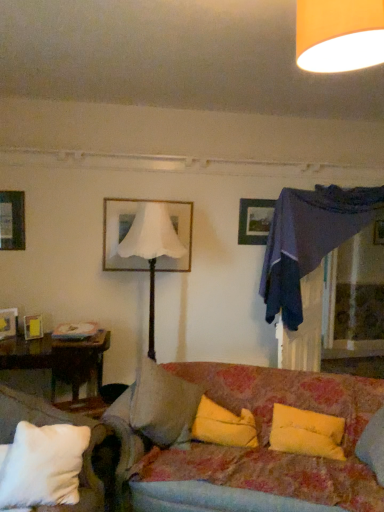
Question: Can you confirm if orange fabric lampshade at upper center, which appears as the 2th lamp when ordered from the bottom, is smaller than floral fabric couch at center?

Choices:
 (A) no
 (B) yes

Answer: (B)

Question: Is orange fabric lampshade at upper center, positioned as the 2th lamp in back-to-front order, shorter than floral fabric couch at center?

Choices:
 (A) no
 (B) yes

Answer: (B)

Question: From the image's perspective, is orange fabric lampshade at upper center, which is the 2th lamp from left to right, above floral fabric couch at center?

Choices:
 (A) yes
 (B) no

Answer: (A)

Question: Can you confirm if orange fabric lampshade at upper center, positioned as the 2th lamp in back-to-front order, is bigger than floral fabric couch at center?

Choices:
 (A) no
 (B) yes

Answer: (A)

Question: Is orange fabric lampshade at upper center, which ranks as the first lamp in front-to-back order, not close to floral fabric couch at center?

Choices:
 (A) no
 (B) yes

Answer: (B)

Question: From the image's perspective, is dark blue fabric canopy bed at upper right located above or below floral fabric couch at center?

Choices:
 (A) below
 (B) above

Answer: (B)

Question: In terms of width, does dark blue fabric canopy bed at upper right look wider or thinner when compared to floral fabric couch at center?

Choices:
 (A) thin
 (B) wide

Answer: (A)

Question: Considering the positions of point (344, 228) and point (279, 373), is point (344, 228) closer or farther from the camera than point (279, 373)?

Choices:
 (A) closer
 (B) farther

Answer: (B)

Question: Based on their positions, is dark blue fabric canopy bed at upper right located to the left or right of floral fabric couch at center?

Choices:
 (A) left
 (B) right

Answer: (B)

Question: Considering the positions of white matte picture frame at upper center, the fourth picture frame in the left-to-right sequence, and brown wooden table at lower left in the image, is white matte picture frame at upper center, the fourth picture frame in the left-to-right sequence, taller or shorter than brown wooden table at lower left?

Choices:
 (A) tall
 (B) short

Answer: (A)

Question: In terms of size, does white matte picture frame at upper center, marked as the first picture frame in a right-to-left arrangement, appear bigger or smaller than brown wooden table at lower left?

Choices:
 (A) big
 (B) small

Answer: (B)

Question: Is white matte picture frame at upper center, the fourth picture frame in the left-to-right sequence, inside the boundaries of brown wooden table at lower left, or outside?

Choices:
 (A) outside
 (B) inside

Answer: (A)

Question: From a real-world perspective, relative to brown wooden table at lower left, is white matte picture frame at upper center, marked as the first picture frame in a right-to-left arrangement, vertically above or below?

Choices:
 (A) below
 (B) above

Answer: (B)

Question: From the image's perspective, is white matte picture frame at upper center, marked as the first picture frame in a right-to-left arrangement, positioned above or below white soft pillow at lower left, positioned as the first pillow in left-to-right order?

Choices:
 (A) above
 (B) below

Answer: (A)

Question: Considering the positions of white matte picture frame at upper center, marked as the first picture frame in a right-to-left arrangement, and white soft pillow at lower left, the 3th pillow from the right, in the image, is white matte picture frame at upper center, marked as the first picture frame in a right-to-left arrangement, bigger or smaller than white soft pillow at lower left, the 3th pillow from the right,?

Choices:
 (A) small
 (B) big

Answer: (A)